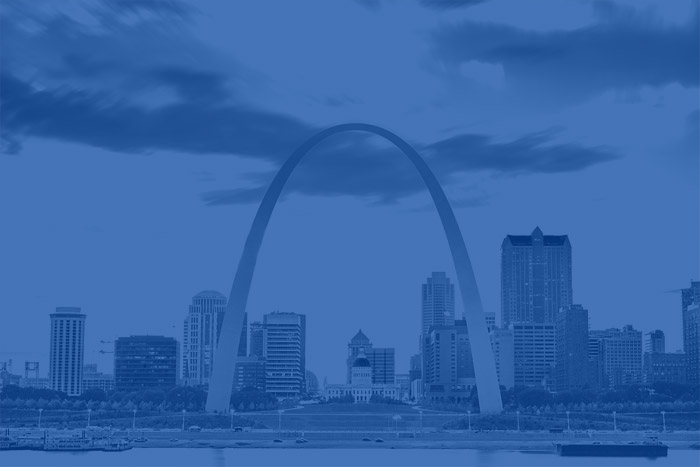
Where is `right side of arch`? right side of arch is located at coordinates (463, 287).